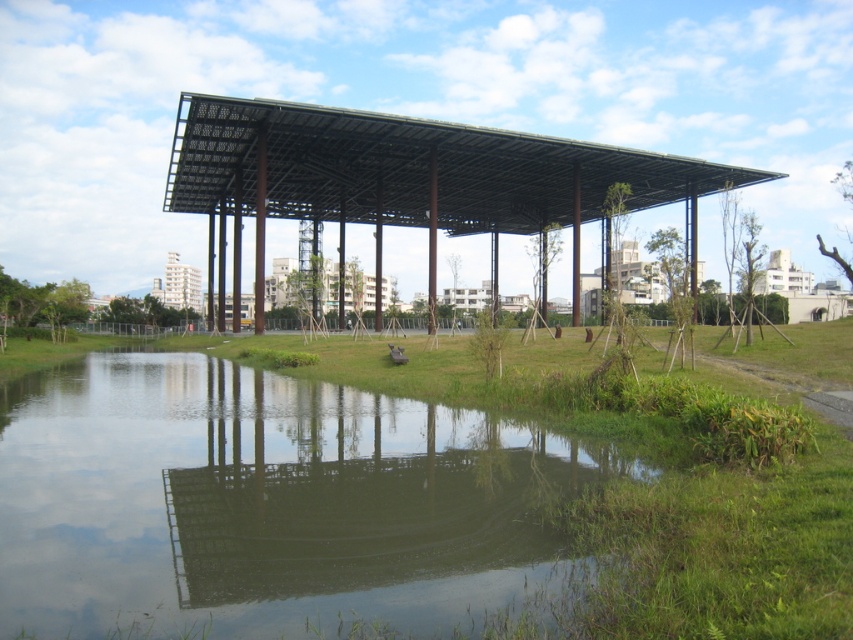
Question: Can you confirm if transparent water at center is positioned to the left of black metal/pergola at center?

Choices:
 (A) no
 (B) yes

Answer: (B)

Question: Is transparent water at center positioned behind black metal/pergola at center?

Choices:
 (A) no
 (B) yes

Answer: (A)

Question: Which of the following is the closest to the observer?

Choices:
 (A) transparent water at center
 (B) black metal/pergola at center

Answer: (A)

Question: Can you confirm if transparent water at center is wider than black metal/pergola at center?

Choices:
 (A) yes
 (B) no

Answer: (B)

Question: Which object appears closest to the camera in this image?

Choices:
 (A) black metal/pergola at center
 (B) transparent water at center

Answer: (B)